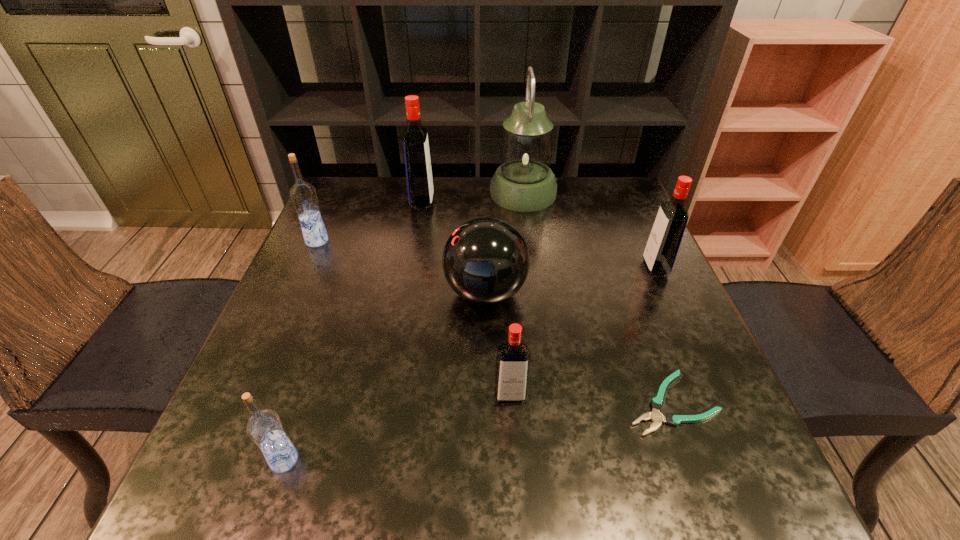
Identify which red vodka is the third nearest to the smaller blue vodka. Please provide its 2D coordinates. Your answer should be formatted as a tuple, i.e. [(x, y)], where the tuple contains the x and y coordinates of a point satisfying the conditions above.

[(665, 238)]

Where is `red vodka identified as the second closest to the third farthest vodka`? red vodka identified as the second closest to the third farthest vodka is located at coordinates (419, 179).

Image resolution: width=960 pixels, height=540 pixels. Identify the location of free spot that satisfies the following two spatial constraints: 1. on the front and back of the biggest red vodka; 2. on the front side of the left blue vodka. (416, 241).

The image size is (960, 540). Find the location of `blank area in the image that satisfies the following two spatial constraints: 1. on the back side of the greenish lantern; 2. on the left side of the nearest vodka`. blank area in the image that satisfies the following two spatial constraints: 1. on the back side of the greenish lantern; 2. on the left side of the nearest vodka is located at coordinates click(x=374, y=193).

Where is `blank area in the image that satisfies the following two spatial constraints: 1. on the front and back of the third farthest vodka; 2. on the front and back of the smallest red vodka`? The height and width of the screenshot is (540, 960). blank area in the image that satisfies the following two spatial constraints: 1. on the front and back of the third farthest vodka; 2. on the front and back of the smallest red vodka is located at coordinates (712, 395).

You are a GUI agent. You are given a task and a screenshot of the screen. Output one action in this format:
    pyautogui.click(x=<x>, y=<y>)
    Task: Click on the vacant area in the image that satisfies the following two spatial constraints: 1. on the front and back of the farthest red vodka; 2. on the left side of the pliers
    This screenshot has height=540, width=960.
    Given the screenshot: What is the action you would take?
    pyautogui.click(x=386, y=403)